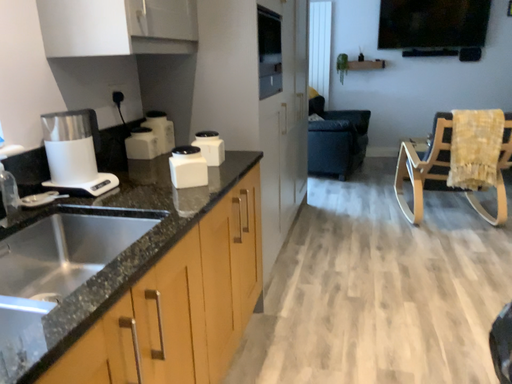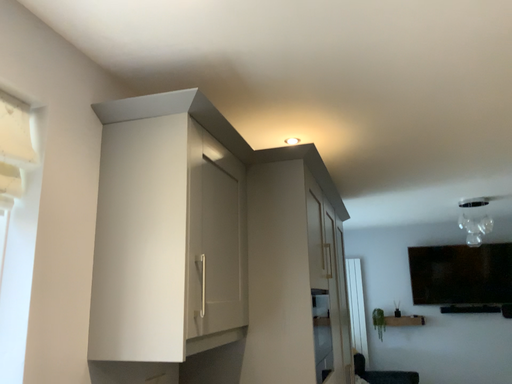
Question: How did the camera likely rotate when shooting the video?

Choices:
 (A) rotated downward
 (B) rotated upward

Answer: (B)